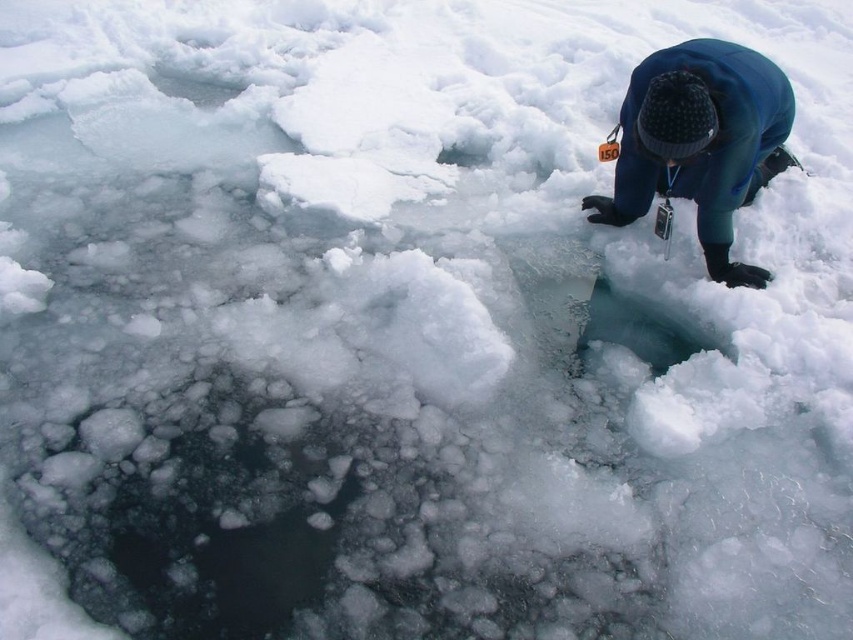
You are a researcher in the Arctic region and need to locate your colleague who is wearing a blue fleece jacket at upper right. According to the coordinates provided, where exactly would you find them?

The blue fleece jacket at upper right is located at point (700, 141).

You are a safety officer assessing the scene. You see the blue fleece jacket at upper right and the transparent ice hole at center. Which object is wider?

The blue fleece jacket at upper right is wider than the transparent ice hole at center according to the description.